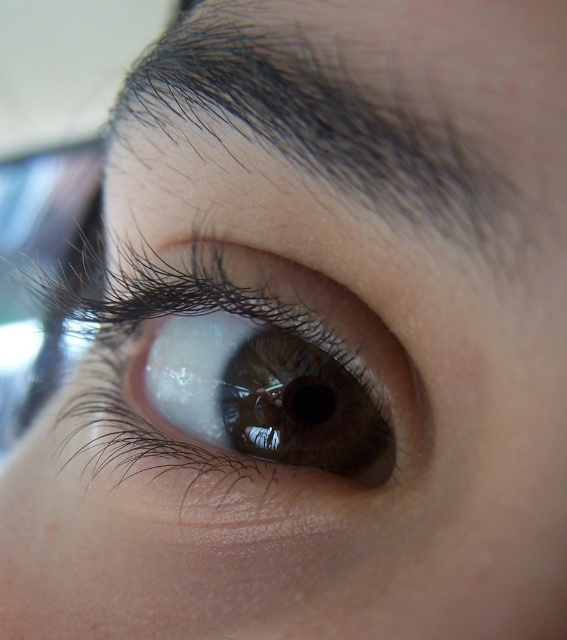
Is dark brown hair at upper center wider than brown glossy eye at center?

In fact, dark brown hair at upper center might be narrower than brown glossy eye at center.

Identify the location of dark brown hair at upper center. Image resolution: width=567 pixels, height=640 pixels. (369, 106).

I want to click on dark brown hair at upper center, so click(x=369, y=106).

Find the location of a particular element. dark brown hair at upper center is located at coordinates (369, 106).